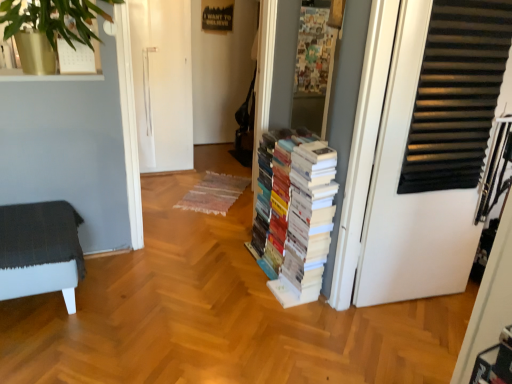
Question: Is dark gray fabric ottoman at left to the left or to the right of white paper books at center in the image?

Choices:
 (A) right
 (B) left

Answer: (B)

Question: Is dark gray fabric ottoman at left taller or shorter than white paper books at center?

Choices:
 (A) short
 (B) tall

Answer: (A)

Question: Estimate the real-world distances between objects in this image. Which object is closer to the dark gray fabric ottoman at left?

Choices:
 (A) white paper books at center
 (B) white matte door at right

Answer: (A)

Question: Which is nearer to the dark gray fabric ottoman at left?

Choices:
 (A) white paper books at center
 (B) white matte door at right

Answer: (A)